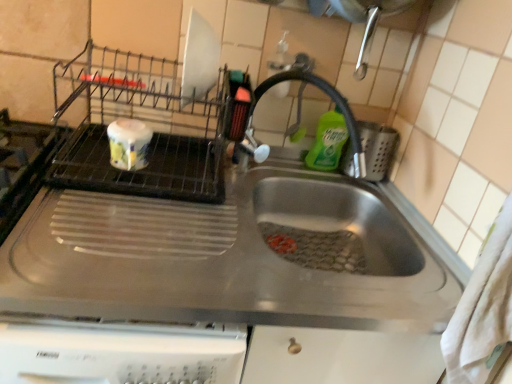
Question: Does green liquid soap at upper right have a lesser width compared to stainless steel sink at center?

Choices:
 (A) yes
 (B) no

Answer: (A)

Question: Is green liquid soap at upper right shorter than stainless steel sink at center?

Choices:
 (A) yes
 (B) no

Answer: (B)

Question: Can you confirm if green liquid soap at upper right is positioned to the right of stainless steel sink at center?

Choices:
 (A) no
 (B) yes

Answer: (B)

Question: From the image's perspective, does green liquid soap at upper right appear higher than stainless steel sink at center?

Choices:
 (A) no
 (B) yes

Answer: (B)

Question: Considering the relative sizes of green liquid soap at upper right and stainless steel sink at center in the image provided, is green liquid soap at upper right taller than stainless steel sink at center?

Choices:
 (A) yes
 (B) no

Answer: (A)

Question: In terms of size, does green liquid soap at upper right appear bigger or smaller than satin nickel faucet at center?

Choices:
 (A) small
 (B) big

Answer: (A)

Question: Considering the positions of green liquid soap at upper right and satin nickel faucet at center in the image, is green liquid soap at upper right wider or thinner than satin nickel faucet at center?

Choices:
 (A) wide
 (B) thin

Answer: (B)

Question: From their relative heights in the image, would you say green liquid soap at upper right is taller or shorter than satin nickel faucet at center?

Choices:
 (A) short
 (B) tall

Answer: (A)

Question: Choose the correct answer: Is green liquid soap at upper right inside satin nickel faucet at center or outside it?

Choices:
 (A) outside
 (B) inside

Answer: (B)

Question: Visually, is green liquid soap at upper right positioned to the left or to the right of stainless steel sink at center?

Choices:
 (A) right
 (B) left

Answer: (A)

Question: Is green liquid soap at upper right wider or thinner than stainless steel sink at center?

Choices:
 (A) wide
 (B) thin

Answer: (B)

Question: Considering the positions of point (340, 120) and point (249, 196), is point (340, 120) closer or farther from the camera than point (249, 196)?

Choices:
 (A) closer
 (B) farther

Answer: (B)

Question: Is green liquid soap at upper right situated inside stainless steel sink at center or outside?

Choices:
 (A) outside
 (B) inside

Answer: (A)

Question: Is point (309, 77) closer or farther from the camera than point (10, 311)?

Choices:
 (A) closer
 (B) farther

Answer: (B)

Question: Is satin nickel faucet at center spatially inside stainless steel sink at center, or outside of it?

Choices:
 (A) inside
 (B) outside

Answer: (B)